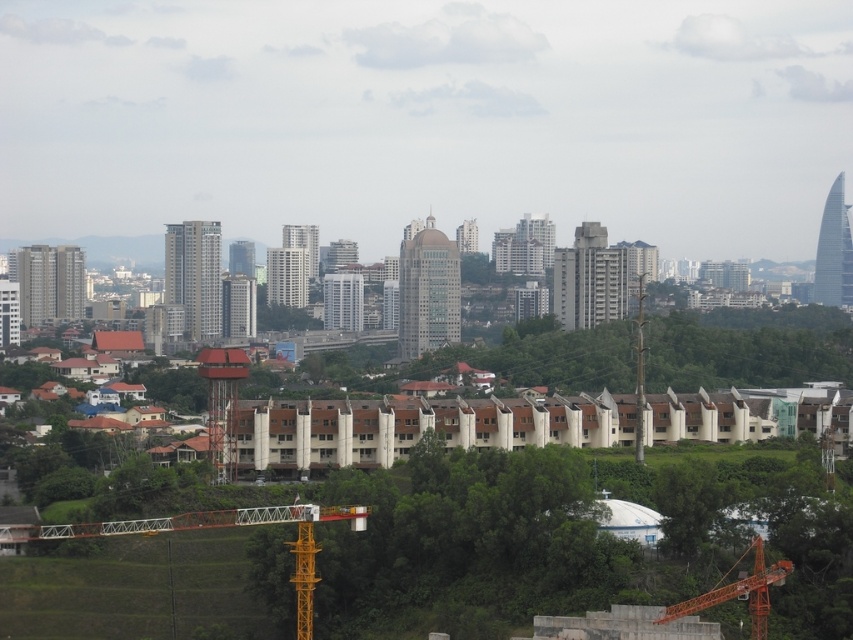
You are a photographer standing at the camera position. You want to capture a photo of the orange metallic crane at lower left. Given that your camera has a maximum zoom range of 1000 meters, will you be able to get a clear shot of the crane?

The orange metallic crane at lower left and the camera are 647.06 meters apart. Since the camera can zoom up to 1000 meters, which is greater than the distance between them, you can get a clear shot of the orange metallic crane at lower left.

You are a delivery drone flying over the city. You need to land safely between the orange metallic crane at lower left and the orange metallic crane at lower right. Which crane should you approach first to ensure a safe landing zone?

The orange metallic crane at lower left is closer to the viewer than the orange metallic crane at lower right, so you should approach the orange metallic crane at lower left first to ensure a safe landing zone.